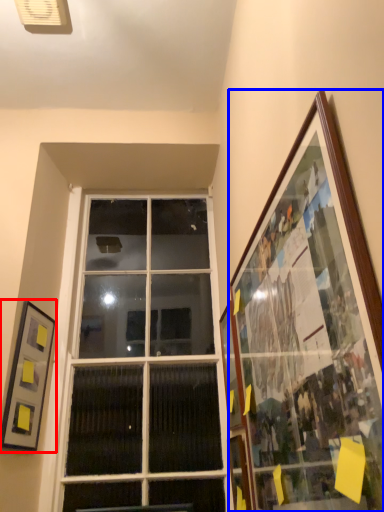
Question: Which of the following is the farthest to the observer, picture frame (highlighted by a red box) or picture frame (highlighted by a blue box)?

Choices:
 (A) picture frame
 (B) picture frame

Answer: (A)